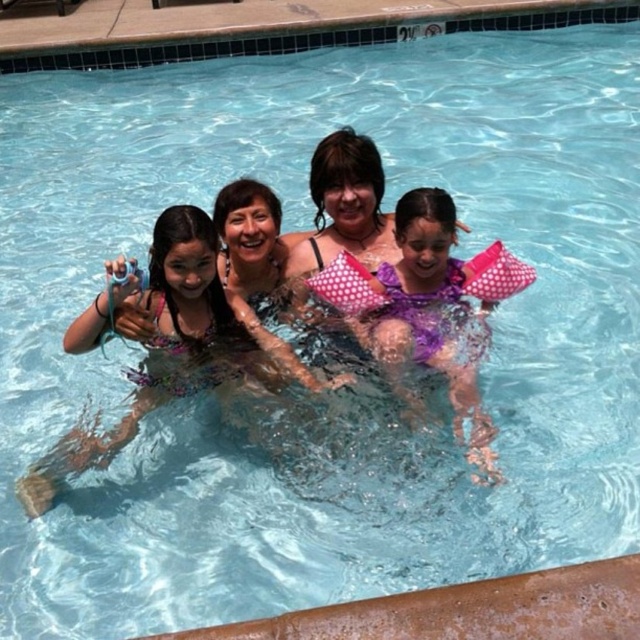
Does point (144, 396) lie in front of point (456, 282)?

Yes, point (144, 396) is closer to viewer.

Does point (164, 304) lie in front of point (384, 262)?

That is True.

Find the location of `purple polka dot swimsuit at left`. purple polka dot swimsuit at left is located at coordinates (156, 342).